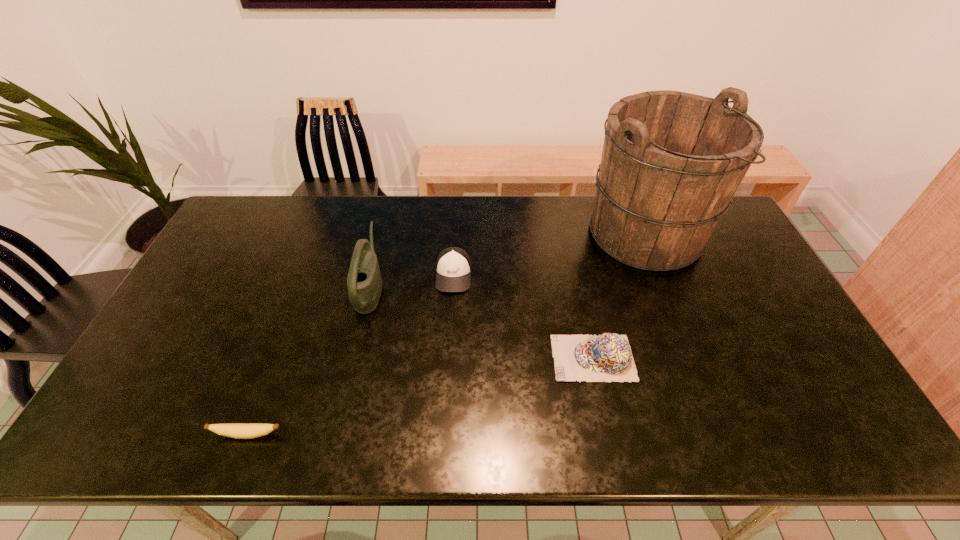
I want to click on vacant region at the far edge of the desktop, so click(319, 206).

Locate an element on the screen. This screenshot has width=960, height=540. free space at the near edge of the desktop is located at coordinates (714, 414).

The image size is (960, 540). I want to click on vacant space at the left edge, so click(198, 274).

Identify the location of free space at the right edge. This screenshot has width=960, height=540. (795, 395).

This screenshot has height=540, width=960. I want to click on free region at the far left corner of the desktop, so [x=270, y=233].

Where is `vacant space in between the leftmost object and the third object from left to right`? The width and height of the screenshot is (960, 540). vacant space in between the leftmost object and the third object from left to right is located at coordinates (350, 355).

Find the location of a particular element. The image size is (960, 540). vacant area between the nearest object and the farther cap is located at coordinates (350, 355).

The width and height of the screenshot is (960, 540). Identify the location of free space between the tallest object and the left cap. (549, 254).

Locate an element on the screen. The height and width of the screenshot is (540, 960). vacant area that lies between the tallest object and the leftmost object is located at coordinates (446, 334).

In order to click on free spot between the second tallest object and the nearer cap in this screenshot , I will do `click(482, 323)`.